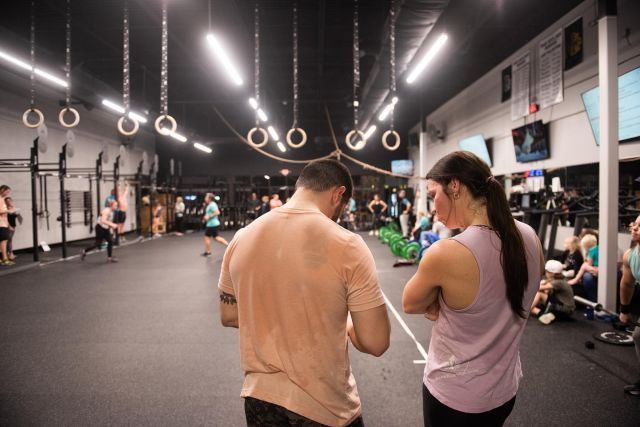
You are a GUI agent. You are given a task and a screenshot of the screen. Output one action in this format:
    pyautogui.click(x=<x>, y=<y>)
    Task: Click on the dark colored ceiling
    The height and width of the screenshot is (427, 640).
    Given the screenshot: What is the action you would take?
    pyautogui.click(x=492, y=43), pyautogui.click(x=323, y=43), pyautogui.click(x=186, y=45), pyautogui.click(x=207, y=126), pyautogui.click(x=323, y=120), pyautogui.click(x=226, y=148), pyautogui.click(x=90, y=35), pyautogui.click(x=525, y=19)